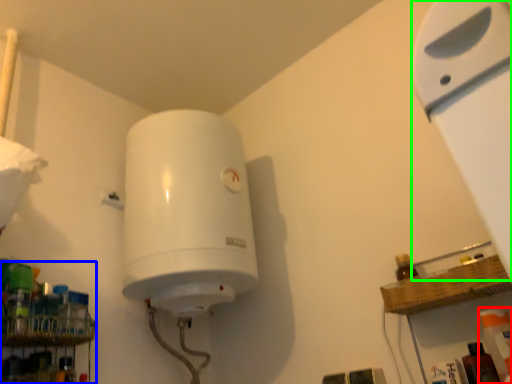
Question: Which is nearer to the cleaning product (highlighted by a red box)? shelf (highlighted by a blue box) or wide (highlighted by a green box).

Choices:
 (A) shelf
 (B) wide

Answer: (B)